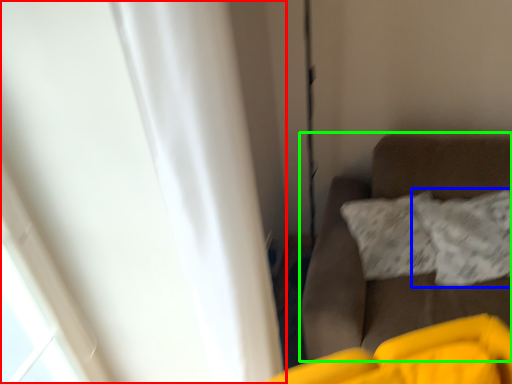
Question: Based on their relative distances, which object is farther from curtain (highlighted by a red box)? Choose from pillow (highlighted by a blue box) and furniture (highlighted by a green box).

Choices:
 (A) pillow
 (B) furniture

Answer: (A)